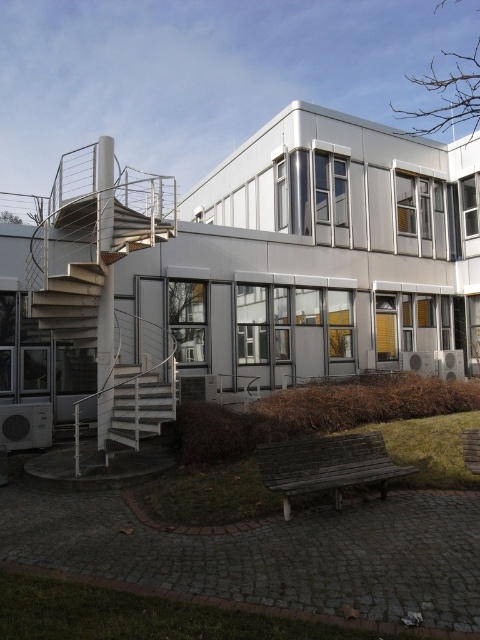
Question: Which point is closer to the camera taking this photo?

Choices:
 (A) pyautogui.click(x=131, y=440)
 (B) pyautogui.click(x=152, y=412)

Answer: (A)

Question: Does white metallic staircase at left have a greater width compared to white metallic staircase at lower left?

Choices:
 (A) no
 (B) yes

Answer: (B)

Question: Does white metallic staircase at left come behind white metallic staircase at lower left?

Choices:
 (A) no
 (B) yes

Answer: (B)

Question: Can you confirm if white metallic staircase at left is bigger than white metallic staircase at lower left?

Choices:
 (A) yes
 (B) no

Answer: (A)

Question: Which of the following is the farthest from the observer?

Choices:
 (A) white metallic staircase at left
 (B) white metallic staircase at lower left

Answer: (A)